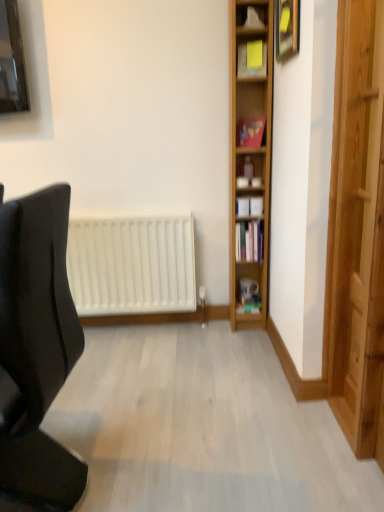
The height and width of the screenshot is (512, 384). In order to click on matte gold picture frame at upper right in this screenshot , I will do `click(286, 28)`.

The width and height of the screenshot is (384, 512). Find the location of `yellow paper at upper center, the first shelf viewed from the top`. yellow paper at upper center, the first shelf viewed from the top is located at coordinates (252, 59).

Find the location of a particular element. The image size is (384, 512). matte red book at center-right, which ranks as the third book in bottom-to-top order is located at coordinates (250, 132).

Is green matte book at lower right, the 1th book from the back, surrounded by yellow paper at upper center, the first shelf viewed from the top?

No, yellow paper at upper center, the first shelf viewed from the top, does not contain green matte book at lower right, the 1th book from the back.

Which is less distant, (247, 45) or (253, 312)?

The point (247, 45) is in front.

Looking at this image, are yellow paper at upper center, acting as the 2th shelf starting from the bottom, and green matte book at lower right, the 1th book from the back, beside each other?

No, yellow paper at upper center, acting as the 2th shelf starting from the bottom, is not beside green matte book at lower right, the 1th book from the back.

From the image's perspective, between yellow paper at upper center, acting as the 2th shelf starting from the bottom, and green matte book at lower right, the 1th book from the back, who is located below?

green matte book at lower right, the 1th book from the back.

Does point (294, 4) appear closer or farther from the camera than point (263, 45)?

Point (294, 4) appears to be closer to the viewer than point (263, 45).

You are a GUI agent. You are given a task and a screenshot of the screen. Output one action in this format:
    pyautogui.click(x=<x>, y=<y>)
    Task: Click on the 2nd shelf behind the matte gold picture frame at upper right
    The image size is (384, 512).
    Given the screenshot: What is the action you would take?
    pyautogui.click(x=252, y=59)

From the picture: From the image's perspective, who appears lower, matte gold picture frame at upper right or yellow paper at upper center, the first shelf viewed from the top?

yellow paper at upper center, the first shelf viewed from the top, is shown below in the image.

Can you tell me how much matte gold picture frame at upper right and yellow paper at upper center, the first shelf viewed from the top, differ in facing direction?

There is a 73.4-degree angle between the facing directions of matte gold picture frame at upper right and yellow paper at upper center, the first shelf viewed from the top.

Between yellow paper at upper center, the first shelf viewed from the top, and black matte chair at left, which one is positioned behind?

yellow paper at upper center, the first shelf viewed from the top.

Is black matte chair at left completely or partially inside yellow paper at upper center, acting as the 2th shelf starting from the bottom?

No, black matte chair at left is not a part of yellow paper at upper center, acting as the 2th shelf starting from the bottom.

Is yellow paper at upper center, the first shelf viewed from the top, placed right next to black matte chair at left?

No.

Is yellow paper at upper center, acting as the 2th shelf starting from the bottom, shorter than black matte chair at left?

Yes, yellow paper at upper center, acting as the 2th shelf starting from the bottom, is shorter than black matte chair at left.

Is matte red book at center-right, which appears as the first book when viewed from the front, wider or thinner than black matte chair at left?

In the image, matte red book at center-right, which appears as the first book when viewed from the front, appears to be more narrow than black matte chair at left.

Does matte red book at center-right, the first book positioned from the top, have a smaller size compared to black matte chair at left?

Yes.

Is matte red book at center-right, the first book positioned from the top, aimed at black matte chair at left?

Yes, matte red book at center-right, the first book positioned from the top, is oriented towards black matte chair at left.

Is point (242, 301) closer or farther from the camera than point (237, 61)?

Point (242, 301) appears to be farther away from the viewer than point (237, 61).

The width and height of the screenshot is (384, 512). What are the coordinates of `the 3rd book behind the yellow paper at upper center, acting as the 2th shelf starting from the bottom, counting from the anchor's position` in the screenshot? It's located at (250, 305).

Considering the sizes of green matte book at lower right, the 1th book when ordered from bottom to top, and yellow paper at upper center, the first shelf viewed from the top, in the image, is green matte book at lower right, the 1th book when ordered from bottom to top, bigger or smaller than yellow paper at upper center, the first shelf viewed from the top,?

Clearly, green matte book at lower right, the 1th book when ordered from bottom to top, is smaller in size than yellow paper at upper center, the first shelf viewed from the top.

From the image's perspective, which is above, green matte book at lower right, the 1th book when ordered from bottom to top, or yellow paper at upper center, acting as the 2th shelf starting from the bottom?

yellow paper at upper center, acting as the 2th shelf starting from the bottom, is shown above in the image.

How much distance is there between yellow paper at upper center, acting as the 2th shelf starting from the bottom, and hardcover book at center-right, which appears as the 2th book when ordered from the bottom?

yellow paper at upper center, acting as the 2th shelf starting from the bottom, and hardcover book at center-right, which appears as the 2th book when ordered from the bottom, are 35.30 inches apart.

Considering their positions, is yellow paper at upper center, acting as the 2th shelf starting from the bottom, located in front of or behind hardcover book at center-right, which appears as the 2th book when ordered from the bottom?

In the image, yellow paper at upper center, acting as the 2th shelf starting from the bottom, appears in front of hardcover book at center-right, which appears as the 2th book when ordered from the bottom.

Locate an element on the screen. The height and width of the screenshot is (512, 384). the 1st shelf counting from the left of the hardcover book at center-right, which is counted as the second book, starting from the top is located at coordinates (252, 59).

Is yellow paper at upper center, acting as the 2th shelf starting from the bottom, not close to hardcover book at center-right, the 2th book in the front-to-back sequence?

No, yellow paper at upper center, acting as the 2th shelf starting from the bottom, is in close proximity to hardcover book at center-right, the 2th book in the front-to-back sequence.

The image size is (384, 512). I want to click on the 1st book to the left of the matte gold picture frame at upper right, counting from the anchor's position, so click(x=250, y=305).

From the image's perspective, is green matte book at lower right, the 1th book when ordered from bottom to top, located above matte gold picture frame at upper right?

No.

Is green matte book at lower right, arranged as the 3th book when viewed from the front, looking in the opposite direction of matte gold picture frame at upper right?

No.

Is there a large distance between green matte book at lower right, arranged as the 3th book when viewed from the front, and matte gold picture frame at upper right?

Yes, green matte book at lower right, arranged as the 3th book when viewed from the front, and matte gold picture frame at upper right are located far from each other.

Locate an element on the screen. The height and width of the screenshot is (512, 384). the 2nd shelf positioned above the green matte book at lower right, the 1th book when ordered from bottom to top (from the image's perspective) is located at coordinates coord(252,59).

This screenshot has width=384, height=512. In order to click on picture frame located on the right of yellow paper at upper center, acting as the 2th shelf starting from the bottom in this screenshot , I will do `click(286, 28)`.

From the image, which object appears to be nearer to yellow paper at upper center, acting as the 2th shelf starting from the bottom, matte gold picture frame at upper right or matte red book at center-right, marked as the 3th book in a back-to-front arrangement?

matte red book at center-right, marked as the 3th book in a back-to-front arrangement.

Considering their positions, is yellow paper at upper center, the first shelf viewed from the top, positioned closer to black matte chair at left than green matte book at lower right, the 1th book when ordered from bottom to top?

green matte book at lower right, the 1th book when ordered from bottom to top, is positioned closer to the anchor black matte chair at left.

Estimate the real-world distances between objects in this image. Which object is closer to matte red book at center-right, marked as the 3th book in a back-to-front arrangement, green matte book at lower right, arranged as the 3th book when viewed from the front, or matte gold picture frame at upper right?

Among the two, matte gold picture frame at upper right is located nearer to matte red book at center-right, marked as the 3th book in a back-to-front arrangement.

From the image, which object appears to be farther from black matte chair at left, hardcover book at center-right, which appears as the 2th book when ordered from the bottom, or green matte book at lower right, the 1th book when ordered from bottom to top?

green matte book at lower right, the 1th book when ordered from bottom to top, is further to black matte chair at left.

From the image, which object appears to be farther from hardcover book at center-right, which appears as the 2th book when ordered from the bottom, matte red book at center-right, which appears as the first book when viewed from the front, or black matte chair at left?

black matte chair at left is positioned further to the anchor hardcover book at center-right, which appears as the 2th book when ordered from the bottom.

Considering their positions, is green matte book at lower right, arranged as the 3th book when viewed from the front, positioned closer to matte gold picture frame at upper right than light brown wooden shelf at right, marked as the 1th shelf in a bottom-to-top arrangement?

light brown wooden shelf at right, marked as the 1th shelf in a bottom-to-top arrangement.

When comparing their distances from light brown wooden shelf at right, marked as the 1th shelf in a bottom-to-top arrangement, does yellow paper at upper center, acting as the 2th shelf starting from the bottom, or hardcover book at center-right, which appears as the 2th book when ordered from the bottom, seem further?

Based on the image, yellow paper at upper center, acting as the 2th shelf starting from the bottom, appears to be further to light brown wooden shelf at right, marked as the 1th shelf in a bottom-to-top arrangement.

Based on their spatial positions, is yellow paper at upper center, the first shelf viewed from the top, or light brown wooden shelf at right, marked as the 1th shelf in a bottom-to-top arrangement, further from matte red book at center-right, the first book positioned from the top?

Among the two, yellow paper at upper center, the first shelf viewed from the top, is located further to matte red book at center-right, the first book positioned from the top.

Image resolution: width=384 pixels, height=512 pixels. Identify the location of shelf between matte red book at center-right, which ranks as the third book in bottom-to-top order, and hardcover book at center-right, which is counted as the second book, starting from the top, in the vertical direction. (249, 152).

Locate an element on the screen. book between yellow paper at upper center, the first shelf viewed from the top, and light brown wooden shelf at right, marked as the 1th shelf in a bottom-to-top arrangement, in the vertical direction is located at coordinates (250, 132).

Locate an element on the screen. shelf between matte gold picture frame at upper right and light brown wooden shelf at right, marked as the 1th shelf in a bottom-to-top arrangement, from top to bottom is located at coordinates (252, 59).

Find the location of `book between matte gold picture frame at upper right and hardcover book at center-right, which appears as the 2th book when ordered from the bottom, in the vertical direction`. book between matte gold picture frame at upper right and hardcover book at center-right, which appears as the 2th book when ordered from the bottom, in the vertical direction is located at coordinates (250, 132).